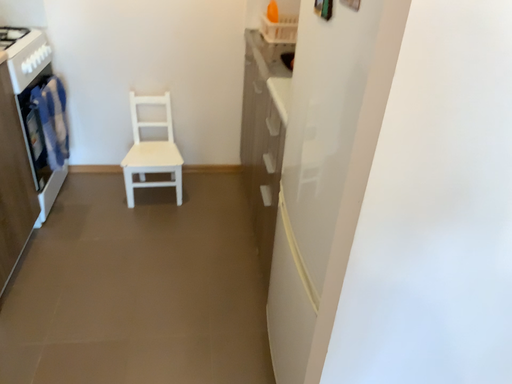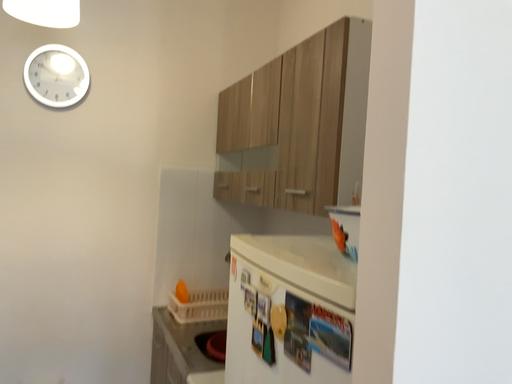
Question: Which way did the camera rotate in the video?

Choices:
 (A) rotated left
 (B) rotated right

Answer: (B)